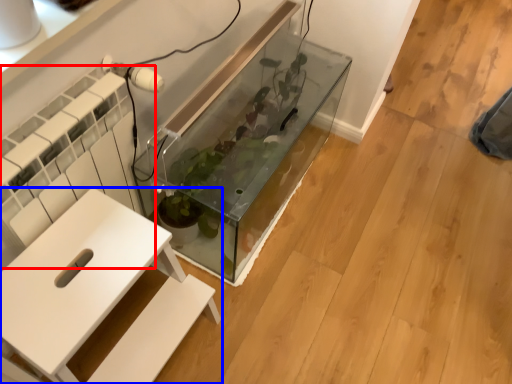
Question: Which object appears farthest to the camera in this image, radiator (highlighted by a red box) or furniture (highlighted by a blue box)?

Choices:
 (A) radiator
 (B) furniture

Answer: (A)